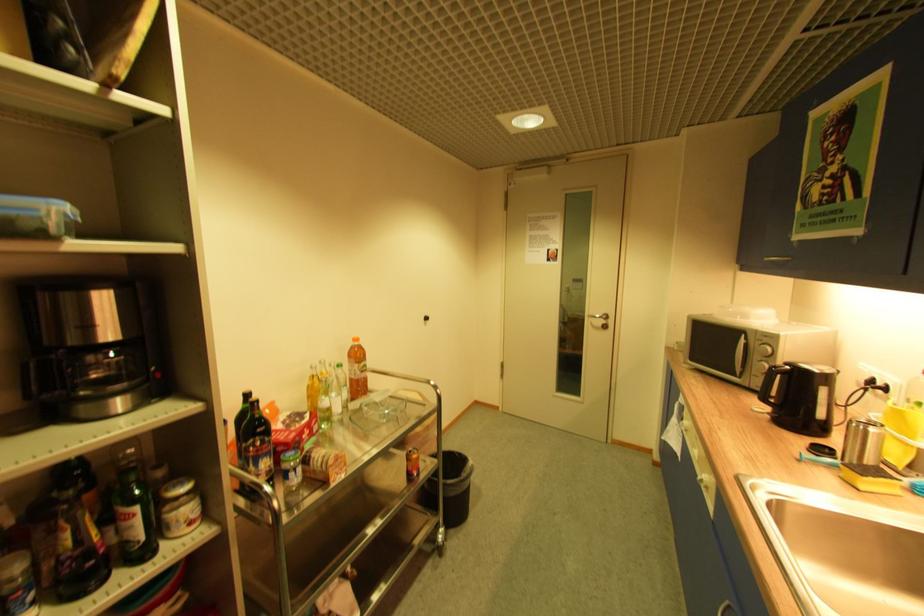
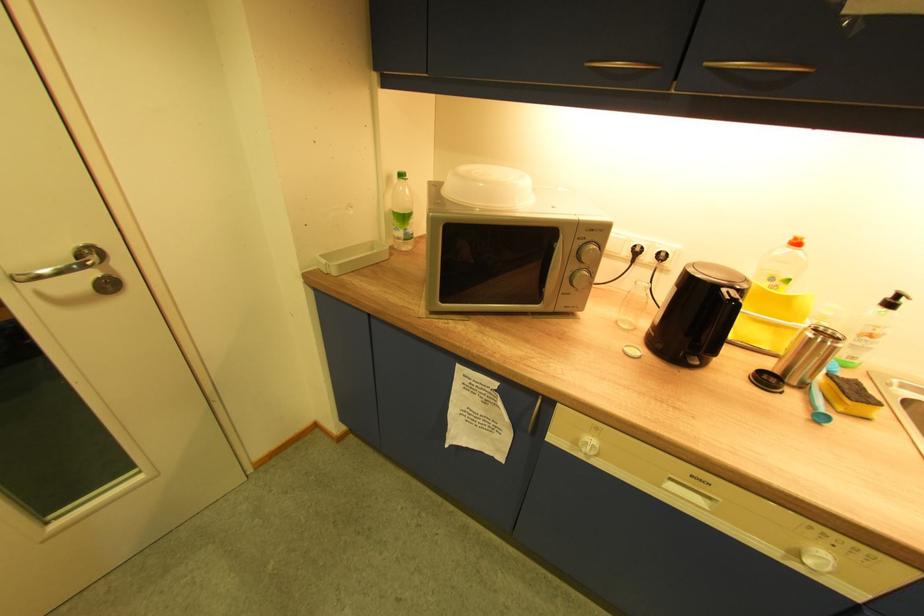
In the second image, find the point that corresponds to (827,450) in the first image.

(772, 382)